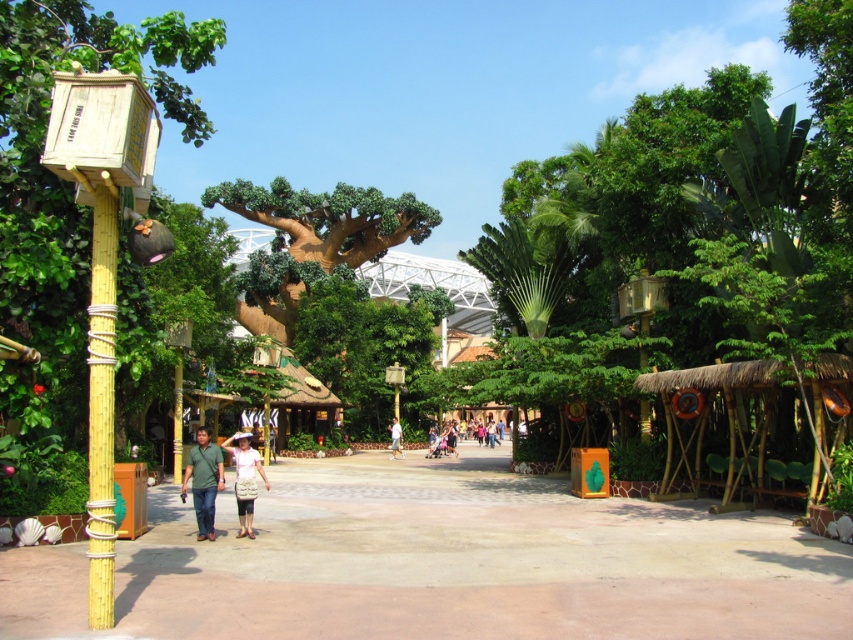
You are standing at the point marked by the coordinates point (x=244, y=477). What is the object located exactly at this position?

The object located exactly at point (x=244, y=477) is the light pink fabric dress at center.

You are standing at the central area of the park and want to take a photo that includes both point (244, 449) and point (397, 426). Which point will appear larger in the photo?

Point (244, 449) is closer to the camera than point (397, 426), so it will appear larger in the photo.